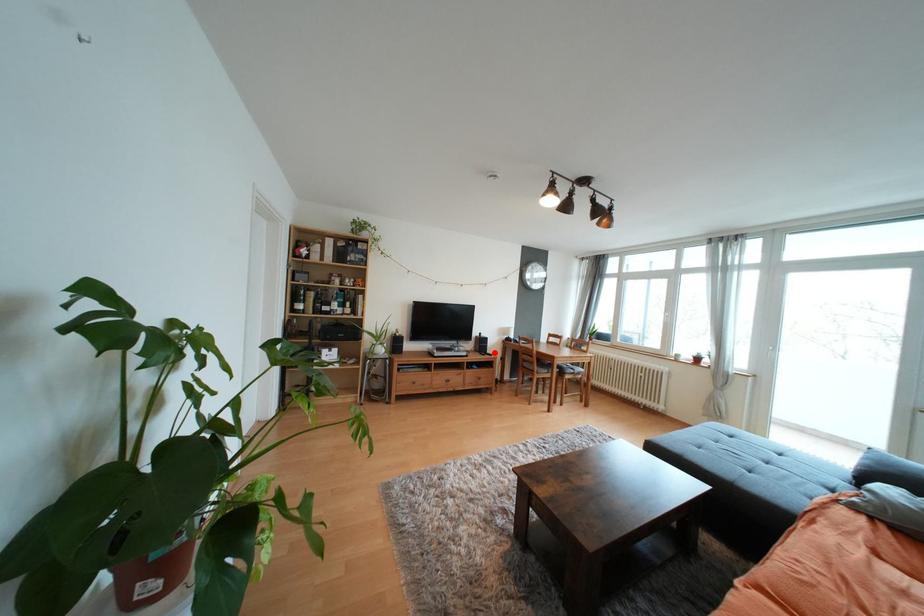
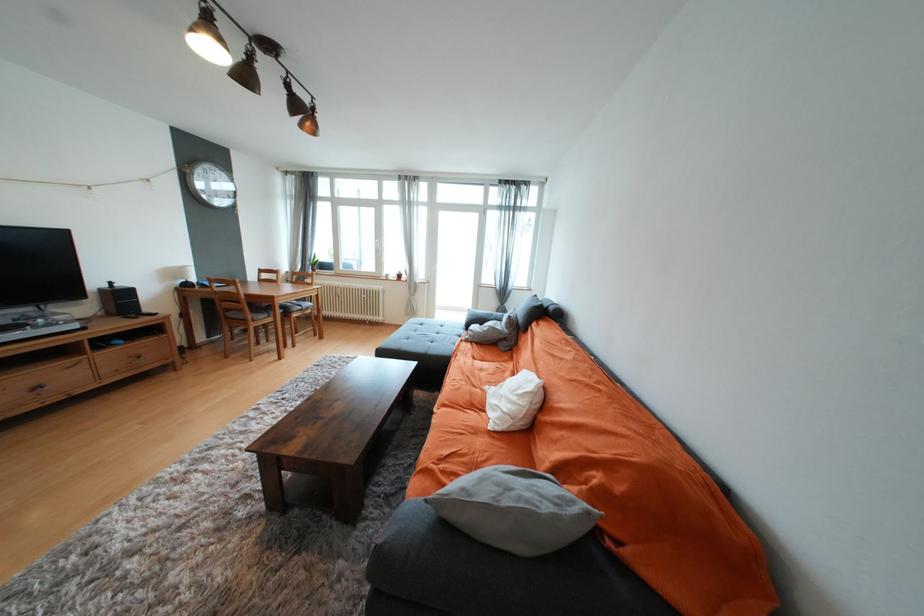
Question: I am providing you with two images of the same scene from different viewpoints. Given a red point in image1, look at the same physical point in image2. Is it:

Choices:
 (A) Closer to the viewpoint
 (B) Farther from the viewpoint

Answer: (A)